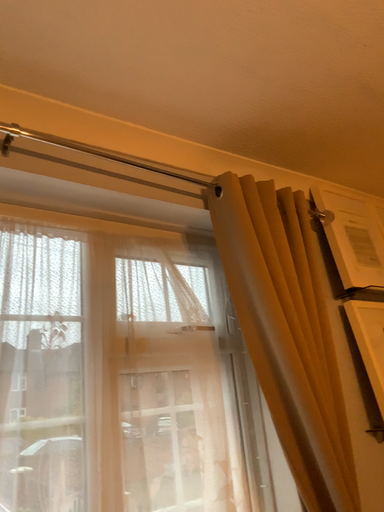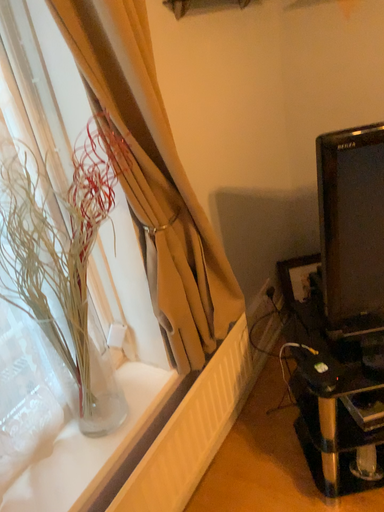
Question: Which way did the camera rotate in the video?

Choices:
 (A) rotated left
 (B) rotated right

Answer: (B)